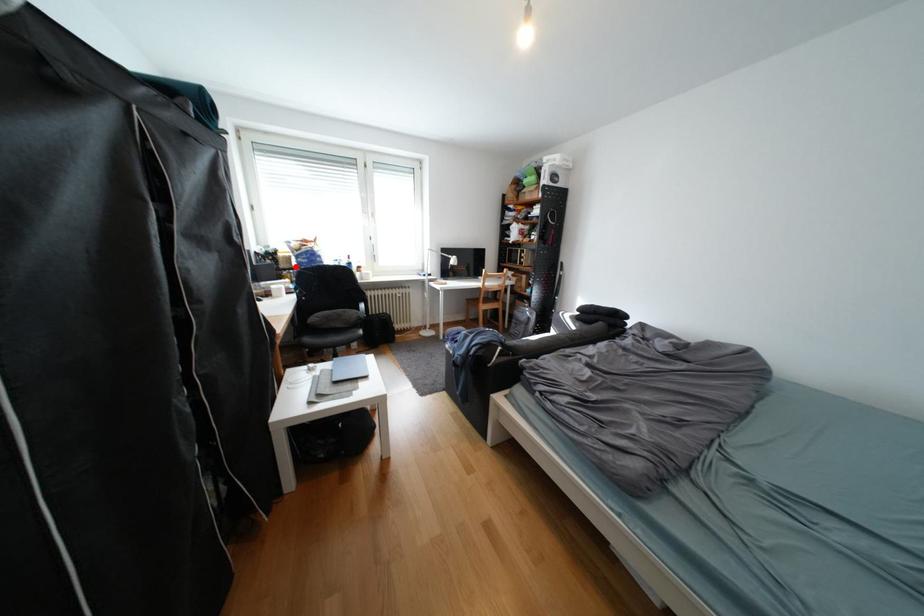
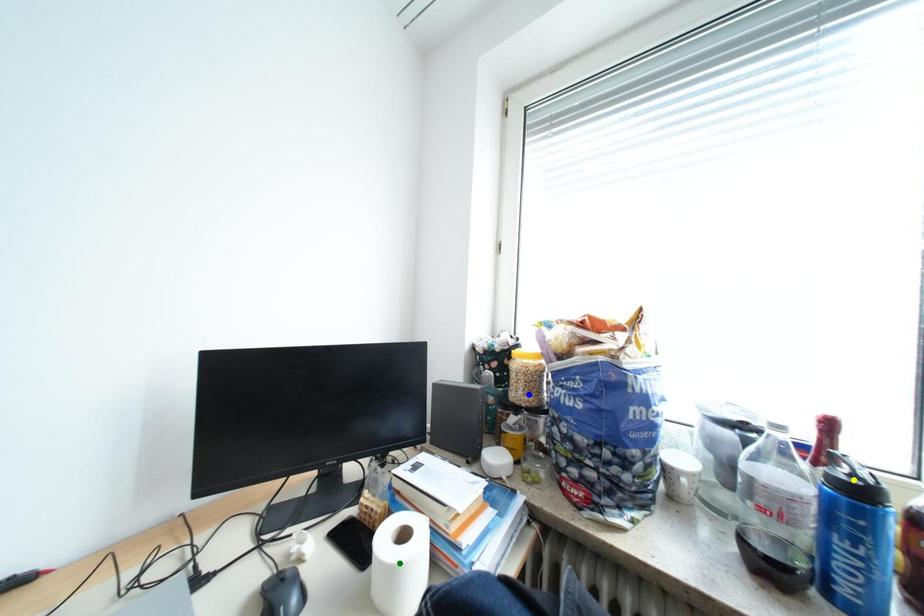
Question: I am providing you with two images of the same scene from different viewpoints. A red point is marked on the first image. You are given multiple points on the second image. Which point in image 2 represents the same 3d spot as the red point in image 1?

Choices:
 (A) green point
 (B) yellow point
 (C) blue point

Answer: (C)